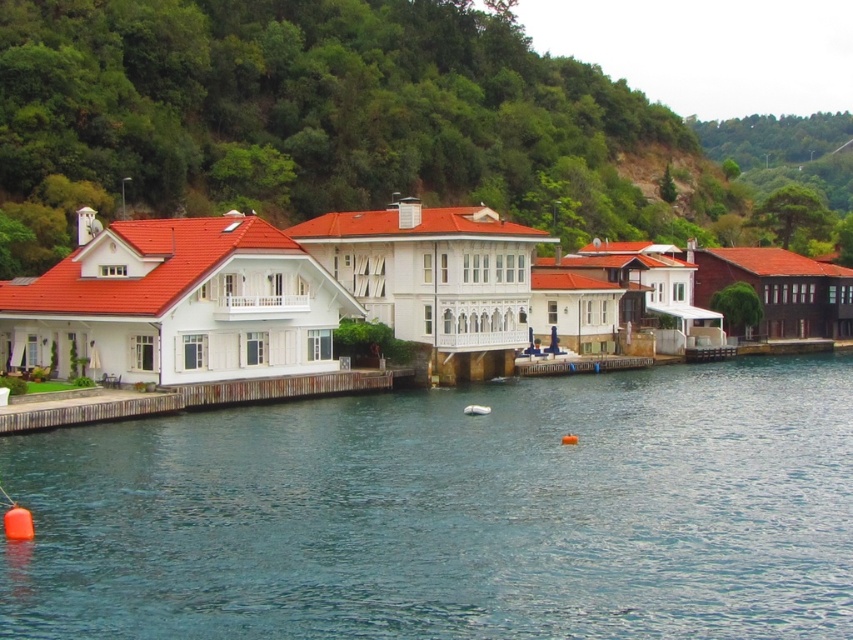
Consider the image. You are planning to place a 3m wide boat on either the blue water at center or the wooden dock at lower left. Based on their widths, which location can accommodate the boat?

The blue water at center has a greater width than the wooden dock at lower left, so the boat can be placed on the blue water at center.

You are standing on the wooden dock at lower left and want to reach the blue water at center. Which direction should you move to get there?

The blue water at center is below the wooden dock at lower left, so you should move downward from the wooden dock at lower left to reach the blue water at center.